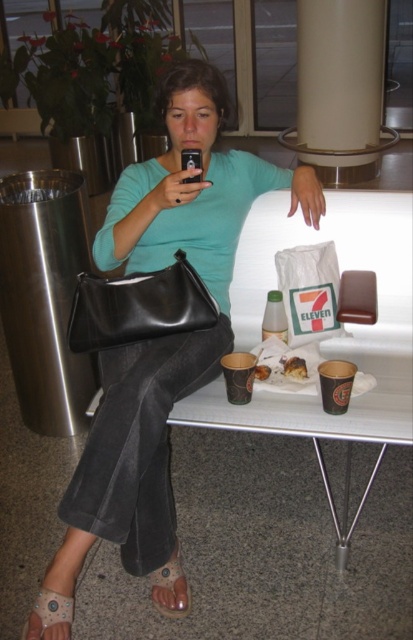
You are a delivery person who needs to place a small package on the table. The package is 15 cm tall. The table has limited space with the matte black purse at center and brown suede sandal at lower left already on it. Can the package fit vertically between these two items?

The matte black purse at center is much taller than the brown suede sandal at lower left. Since the package is 15 cm tall, it might fit vertically between them if there is enough space, but the exact height difference isn

You are standing in front of the table where the woman is sitting. There are two points marked on the table. Which point is closer to you, point (73, 596) or point (170, 612)?

Point (73, 596) is closer to the viewer than point (170, 612).

You are a delivery robot with a 25 inch wide package that needs to be placed between the matte black purse at center and the leather sandal at lower left. Can you fit the package between them without moving either object?

The distance between the matte black purse at center and the leather sandal at lower left is 27.63 inches. Since the package is 25 inches wide, it can fit between them as there is enough space.